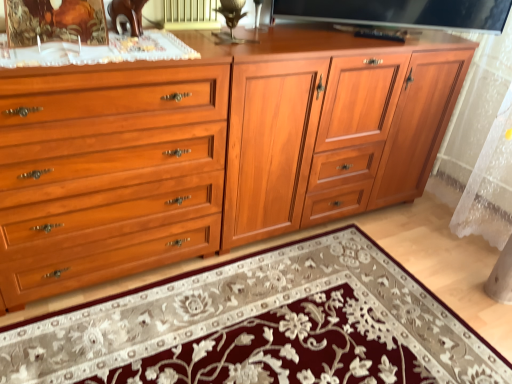
Question: Looking at their shapes, would you say satin black tv at upper center is wider or thinner than matte wood chest of drawers at left?

Choices:
 (A) wide
 (B) thin

Answer: (B)

Question: Considering their positions, is satin black tv at upper center located in front of or behind matte wood chest of drawers at left?

Choices:
 (A) front
 (B) behind

Answer: (B)

Question: Which of these objects is positioned closest to the satin black tv at upper center?

Choices:
 (A) wooden picture frame at upper left
 (B) embroidered wool mat at center
 (C) matte wood chest of drawers at left
 (D) matte wood cabinet at center
 (E) matte gold radiator at upper center

Answer: (D)

Question: Which object is the closest to the matte wood cabinet at center?

Choices:
 (A) wooden picture frame at upper left
 (B) matte wood chest of drawers at left
 (C) satin black tv at upper center
 (D) matte gold radiator at upper center
 (E) embroidered wool mat at center

Answer: (C)